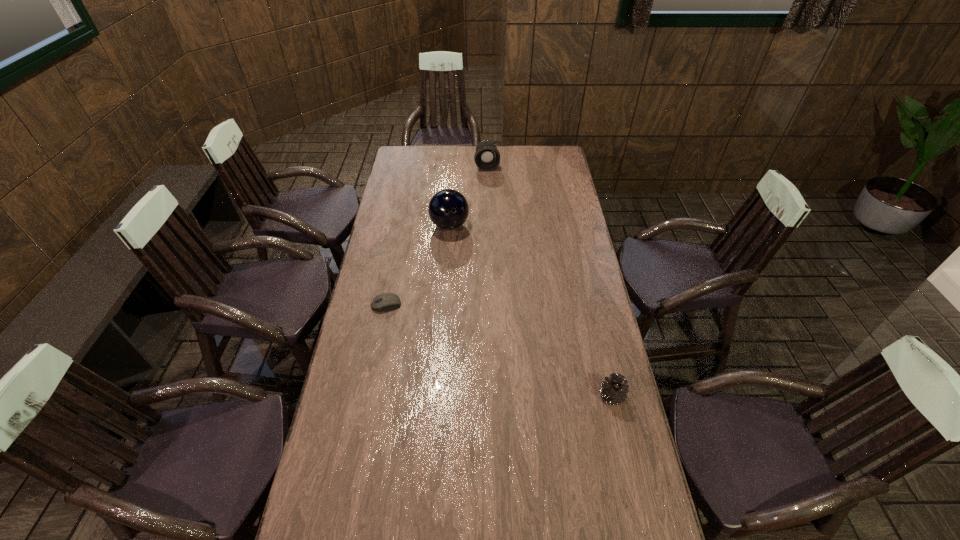
Locate an element on the screen. vacant space that is in between the leftmost object and the tallest object is located at coordinates (418, 265).

This screenshot has width=960, height=540. What are the coordinates of `free space between the rightmost object and the bowling ball` in the screenshot? It's located at click(531, 310).

This screenshot has width=960, height=540. What are the coordinates of `free spot between the telephoto lens and the third farthest object` in the screenshot? It's located at (437, 235).

Where is `vacant point located between the third nearest object and the second nearest object`? This screenshot has width=960, height=540. vacant point located between the third nearest object and the second nearest object is located at coordinates (418, 265).

You are a GUI agent. You are given a task and a screenshot of the screen. Output one action in this format:
    pyautogui.click(x=<x>, y=<y>)
    Task: Click on the object that stands as the third closest to the nearest object
    Image resolution: width=960 pixels, height=540 pixels.
    Given the screenshot: What is the action you would take?
    [x=487, y=157]

Select which object appears as the closest to the second object from right to left. Please provide its 2D coordinates. Your answer should be formatted as a tuple, i.e. [(x, y)], where the tuple contains the x and y coordinates of a point satisfying the conditions above.

[(448, 209)]

Identify the location of blank space that satisfies the following two spatial constraints: 1. on the front side of the second shortest object; 2. on the left side of the third shortest object. The image size is (960, 540). [492, 396].

Where is `vacant region that satisfies the following two spatial constraints: 1. on the front side of the nearest object; 2. on the left side of the shortest object`? The width and height of the screenshot is (960, 540). vacant region that satisfies the following two spatial constraints: 1. on the front side of the nearest object; 2. on the left side of the shortest object is located at coordinates (369, 396).